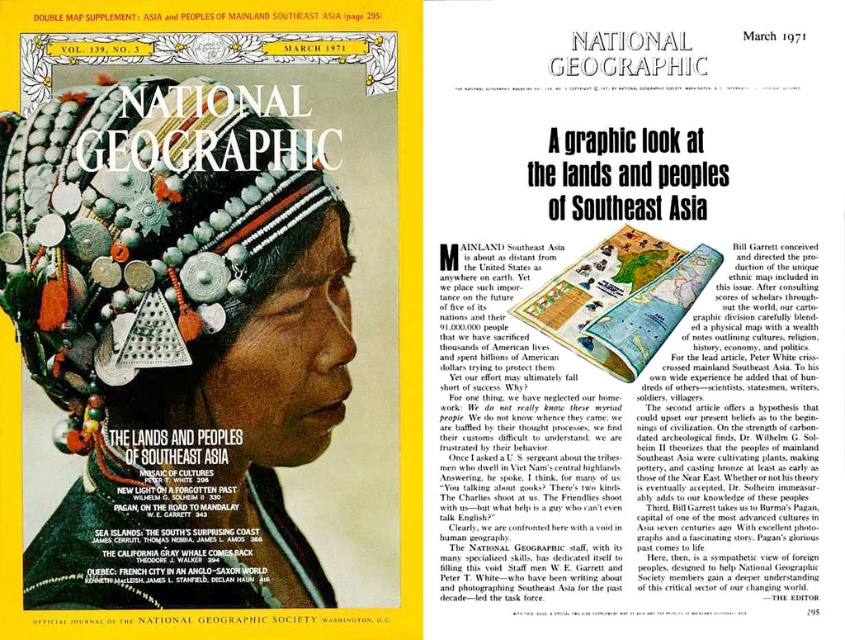
Is silver metallic beads and triangles at center positioned behind matte paper map at center?

That is False.

Is point (169, 298) positioned in front of point (657, 244)?

Yes, point (169, 298) is closer to viewer.

Find the location of `silver metallic beads and triangles at center`. silver metallic beads and triangles at center is located at coordinates (137, 228).

The height and width of the screenshot is (640, 845). What are the coordinates of `silver metallic beads and triangles at center` in the screenshot? It's located at (137, 228).